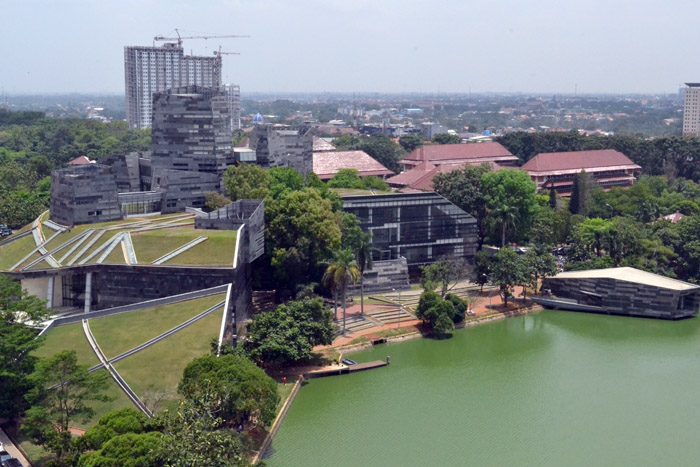
Identify the location of walk way. Image resolution: width=700 pixels, height=467 pixels. (99, 357).